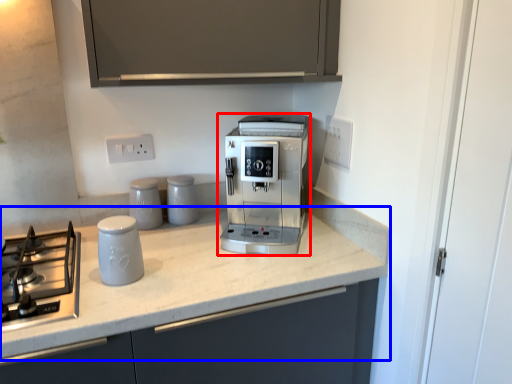
Question: Which object is further to the camera taking this photo, coffee maker (highlighted by a red box) or countertop (highlighted by a blue box)?

Choices:
 (A) coffee maker
 (B) countertop

Answer: (A)